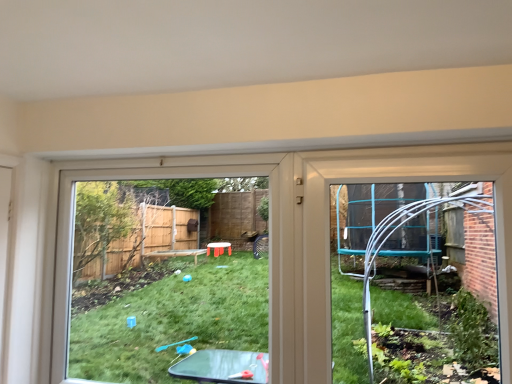
Question: Considering the relative sizes of transparent plastic table at center and clear plastic trampoline at right in the image provided, is transparent plastic table at center thinner than clear plastic trampoline at right?

Choices:
 (A) yes
 (B) no

Answer: (B)

Question: From a real-world perspective, is transparent plastic table at center located beneath clear plastic trampoline at right?

Choices:
 (A) yes
 (B) no

Answer: (A)

Question: Can you confirm if transparent plastic table at center is positioned to the right of clear plastic trampoline at right?

Choices:
 (A) no
 (B) yes

Answer: (A)

Question: Is transparent plastic table at center bigger than clear plastic trampoline at right?

Choices:
 (A) no
 (B) yes

Answer: (B)

Question: Can you see transparent plastic table at center touching clear plastic trampoline at right?

Choices:
 (A) no
 (B) yes

Answer: (A)

Question: Does transparent plastic table at center turn towards clear plastic trampoline at right?

Choices:
 (A) yes
 (B) no

Answer: (B)

Question: Considering the relative sizes of clear plastic trampoline at right and transparent plastic table at center in the image provided, is clear plastic trampoline at right shorter than transparent plastic table at center?

Choices:
 (A) yes
 (B) no

Answer: (A)

Question: Considering the relative positions of clear plastic trampoline at right and transparent plastic table at center in the image provided, is clear plastic trampoline at right to the left of transparent plastic table at center from the viewer's perspective?

Choices:
 (A) no
 (B) yes

Answer: (A)

Question: Does clear plastic trampoline at right have a greater width compared to transparent plastic table at center?

Choices:
 (A) no
 (B) yes

Answer: (A)

Question: From a real-world perspective, is clear plastic trampoline at right located beneath transparent plastic table at center?

Choices:
 (A) yes
 (B) no

Answer: (B)

Question: Is clear plastic trampoline at right positioned behind transparent plastic table at center?

Choices:
 (A) yes
 (B) no

Answer: (B)

Question: Would you say clear plastic trampoline at right contains transparent plastic table at center?

Choices:
 (A) yes
 (B) no

Answer: (B)

Question: Considering the positions of transparent plastic table at center and clear plastic trampoline at right in the image, is transparent plastic table at center bigger or smaller than clear plastic trampoline at right?

Choices:
 (A) small
 (B) big

Answer: (B)